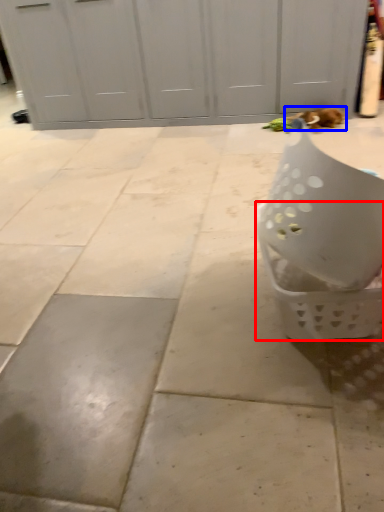
Question: Among these objects, which one is nearest to the camera, basket (highlighted by a red box) or cat (highlighted by a blue box)?

Choices:
 (A) basket
 (B) cat

Answer: (A)